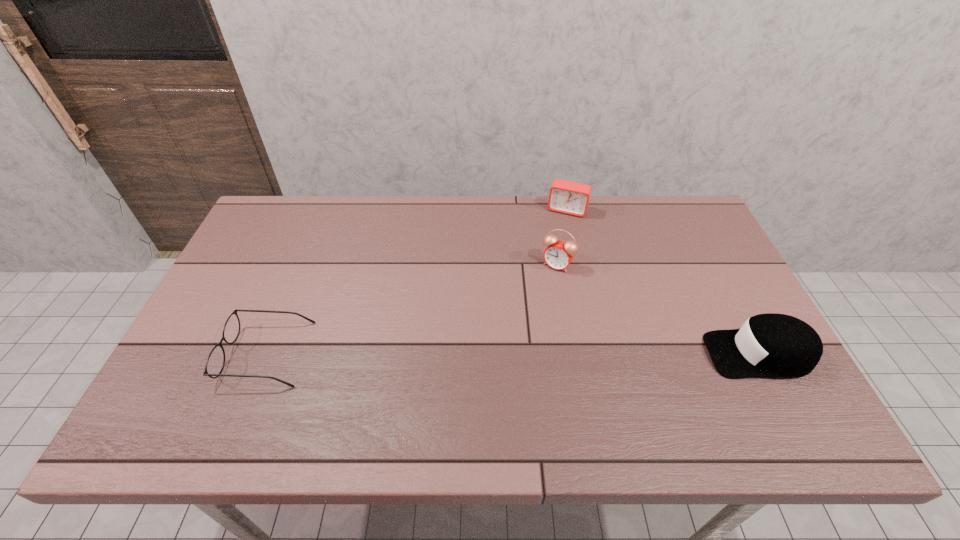
Identify the location of vacant space situated 0.330m on the front-facing side of the rightmost object. Image resolution: width=960 pixels, height=540 pixels. (573, 354).

What are the coordinates of `free spot located 0.230m on the front-facing side of the rightmost object` in the screenshot? It's located at (613, 354).

What are the coordinates of `vacant space located on the clock face of the nearer alarm clock` in the screenshot? It's located at (487, 370).

This screenshot has height=540, width=960. Find the location of `vacant region located on the clock face of the nearer alarm clock`. vacant region located on the clock face of the nearer alarm clock is located at coordinates (502, 347).

The width and height of the screenshot is (960, 540). Identify the location of vacant space situated on the clock face of the nearer alarm clock. (528, 307).

Find the location of `free region located 0.370m on the front-facing side of the farthest object`. free region located 0.370m on the front-facing side of the farthest object is located at coordinates (533, 297).

Image resolution: width=960 pixels, height=540 pixels. What are the coordinates of `vacant space located 0.230m on the front-facing side of the farthest object` in the screenshot? It's located at (545, 264).

This screenshot has height=540, width=960. I want to click on vacant region located on the front-facing side of the farthest object, so click(x=537, y=287).

Locate an element on the screen. The height and width of the screenshot is (540, 960). object that is positioned at the far edge is located at coordinates (567, 197).

You are a GUI agent. You are given a task and a screenshot of the screen. Output one action in this format:
    pyautogui.click(x=<x>, y=<y>)
    Task: Click on the spectacles positioned at the near edge
    Image resolution: width=960 pixels, height=540 pixels.
    Given the screenshot: What is the action you would take?
    pyautogui.click(x=215, y=363)